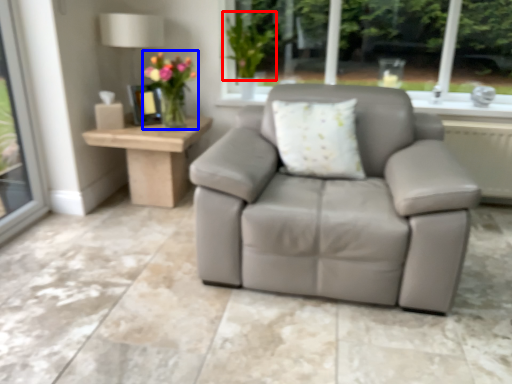
Question: Among these objects, which one is farthest to the camera, plant (highlighted by a red box) or floral arrangement (highlighted by a blue box)?

Choices:
 (A) plant
 (B) floral arrangement

Answer: (A)